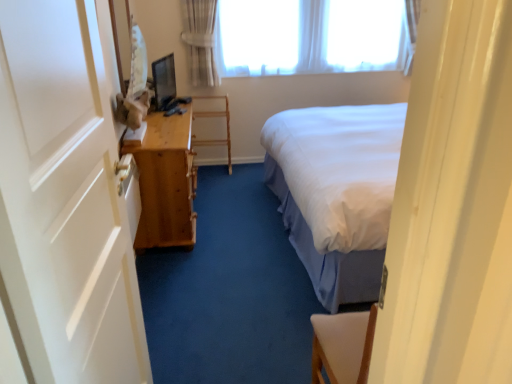
Question: In terms of height, does white sheer curtain at upper center look taller or shorter compared to white painted wood door at left?

Choices:
 (A) tall
 (B) short

Answer: (B)

Question: Is point (276, 46) positioned closer to the camera than point (46, 258)?

Choices:
 (A) closer
 (B) farther

Answer: (B)

Question: Which object is positioned farthest from the white painted wood door at left?

Choices:
 (A) light brown wooden table at left
 (B) wooden shelf at center
 (C) white sheer curtain at upper center

Answer: (C)

Question: Estimate the real-world distances between objects in this image. Which object is farther from the light brown wooden table at left?

Choices:
 (A) white painted wood door at left
 (B) wooden shelf at center
 (C) white sheer curtain at upper center

Answer: (C)